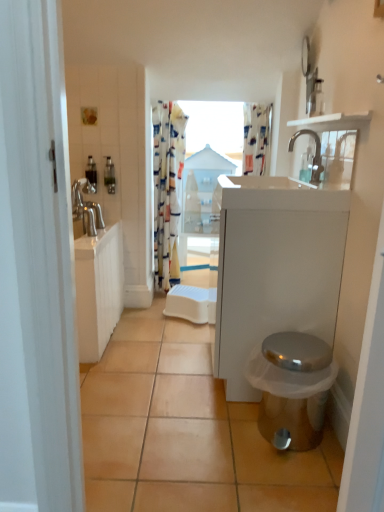
The image size is (384, 512). Find the location of `empty space that is ontop of orange matte tile at lower center (from a real-world perspective)`. empty space that is ontop of orange matte tile at lower center (from a real-world perspective) is located at coordinates (178, 387).